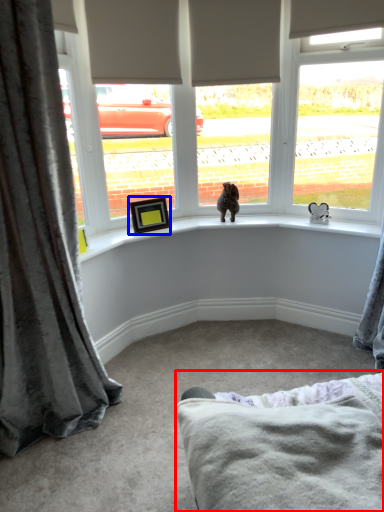
Question: Among these objects, which one is farthest to the camera, bedding (highlighted by a red box) or picture frame (highlighted by a blue box)?

Choices:
 (A) bedding
 (B) picture frame

Answer: (B)